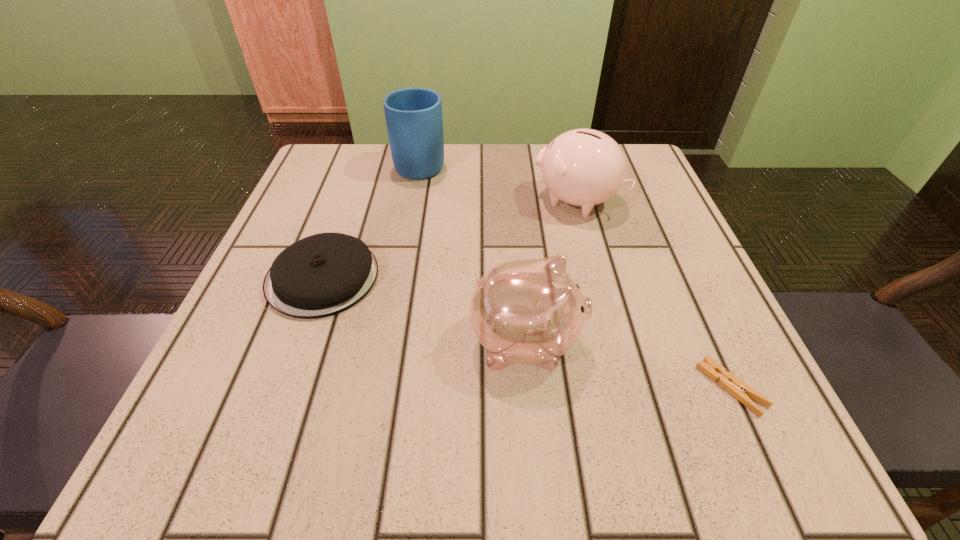
The height and width of the screenshot is (540, 960). I want to click on mug that is at the far edge, so click(x=414, y=121).

Identify the location of piggy bank that is at the far edge. pyautogui.click(x=584, y=167).

Where is `object that is at the near edge`? The width and height of the screenshot is (960, 540). object that is at the near edge is located at coordinates (740, 390).

Find the location of a particular element. This screenshot has width=960, height=540. object that is at the left edge is located at coordinates (324, 274).

Locate an element on the screen. The width and height of the screenshot is (960, 540). piggy bank that is at the right edge is located at coordinates (584, 167).

At what (x,y) coordinates should I click in order to perform the action: click on clothespin located in the right edge section of the desktop. Please return your answer as a coordinate pair (x, y). Image resolution: width=960 pixels, height=540 pixels. Looking at the image, I should click on (740, 390).

The width and height of the screenshot is (960, 540). Find the location of `object that is at the far right corner`. object that is at the far right corner is located at coordinates (584, 167).

Where is `object present at the near right corner`? The image size is (960, 540). object present at the near right corner is located at coordinates (740, 390).

Identify the location of vacant area at the far edge. (462, 151).

At what (x,y) coordinates should I click in order to perform the action: click on vacant space at the near edge of the desktop. Please return your answer as a coordinate pair (x, y). The width and height of the screenshot is (960, 540). Looking at the image, I should click on (x=500, y=440).